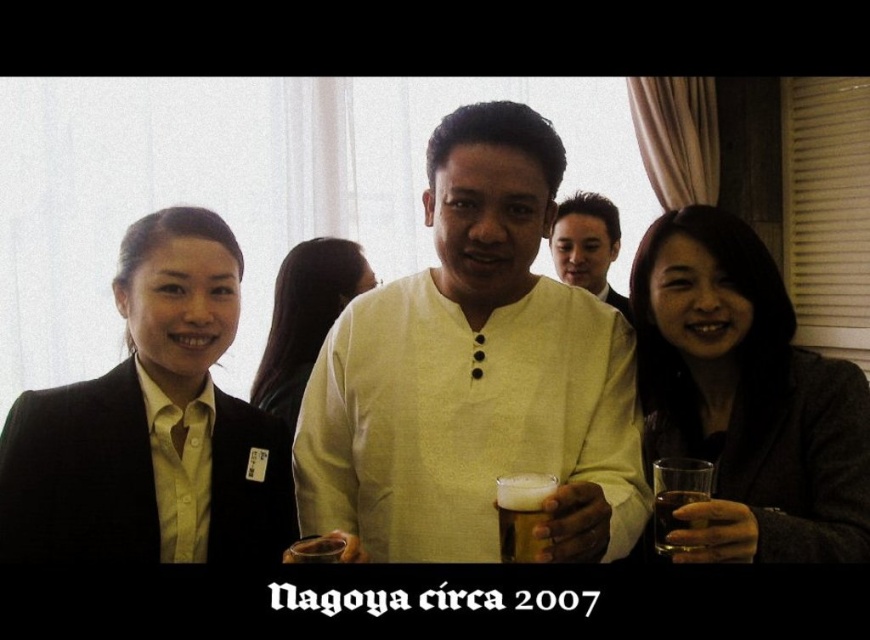
From the picture: You are standing in the room and want to grab the translucent glass at right. Based on its position at point 0.780, 0.779, where exactly should you look to find it?

The translucent glass at right is located at the coordinates 0.780 on the x axis and 0.779 on the y axis.

You are organizing a photo shoot and need to ensure proper spacing between the matte black blazer at left and the matte yellow shirt at center for a wide shot. Given that the camera requires at least 30 inches between subjects for clarity, will the current distance suffice?

The matte black blazer at left is 28.46 inches from the matte yellow shirt at center, which is less than the required 30 inches. The current distance may not provide sufficient clarity for the wide shot.